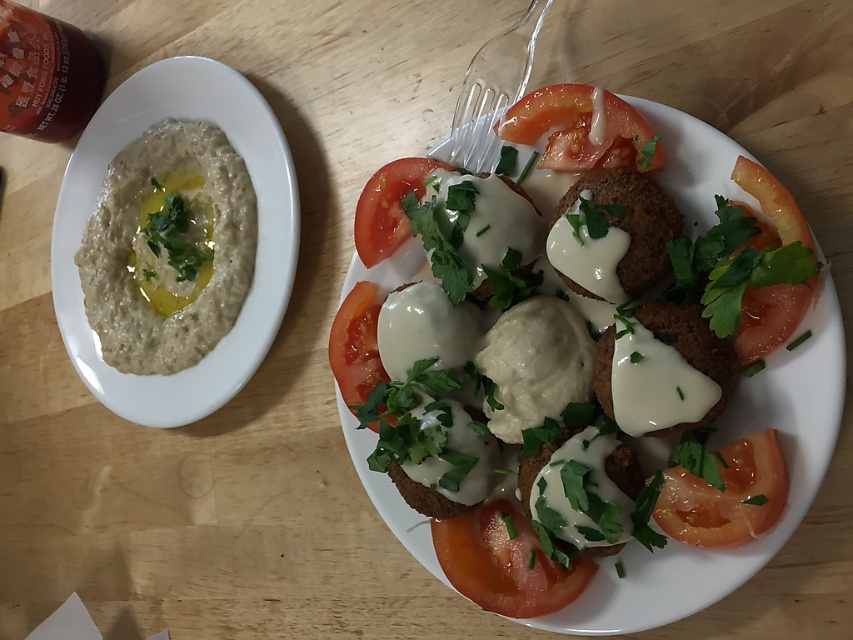
Question: Which point is closer to the camera?

Choices:
 (A) (434, 541)
 (B) (521, 157)
 (C) (120, 308)

Answer: (B)

Question: Can you confirm if white creamy falafel at center is smaller than red smooth tomato at center?

Choices:
 (A) no
 (B) yes

Answer: (A)

Question: Does white creamy hummus at left lie behind white creamy cheese at center?

Choices:
 (A) yes
 (B) no

Answer: (A)

Question: Which point is closer to the camera?

Choices:
 (A) red matte tomato at center
 (B) white creamy hummus at left
 (C) juicy red tomato at upper center

Answer: (C)

Question: Does red matte tomato at center appear under juicy red tomato at upper center?

Choices:
 (A) yes
 (B) no

Answer: (A)

Question: Which of the following is the farthest from the observer?

Choices:
 (A) white creamy hummus at left
 (B) juicy red tomato at upper center
 (C) transparent plastic fork at upper center

Answer: (A)